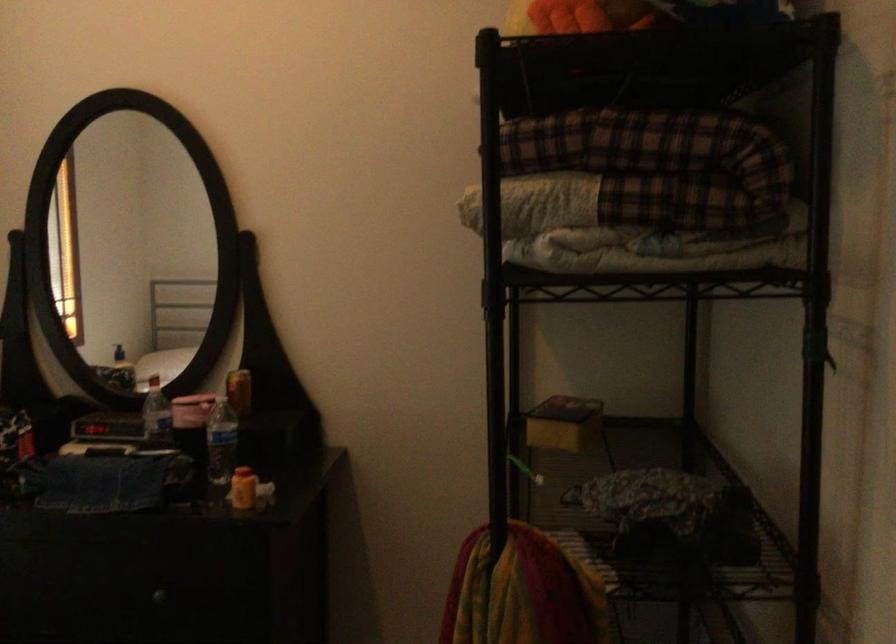
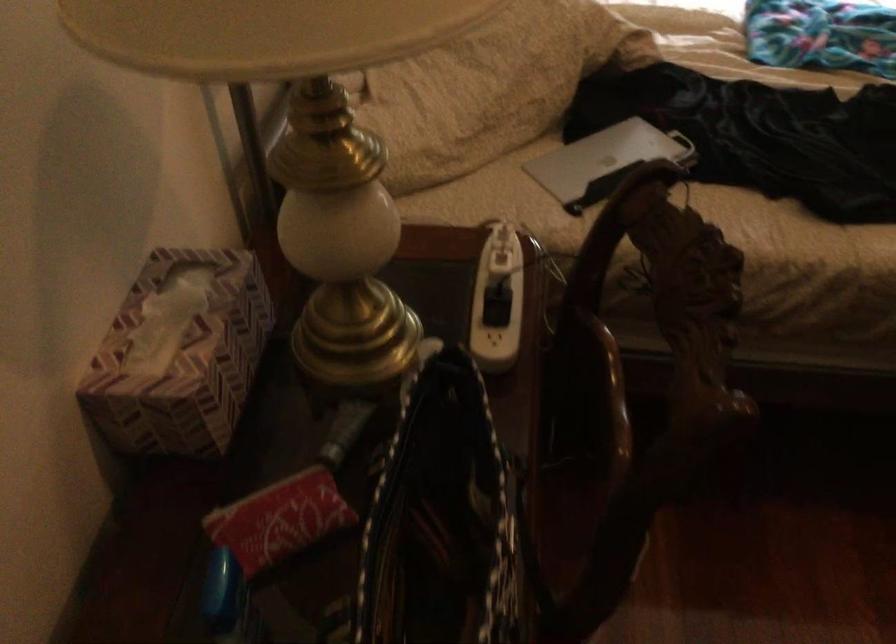
How did the camera likely rotate?

The camera's rotation is toward left-down.